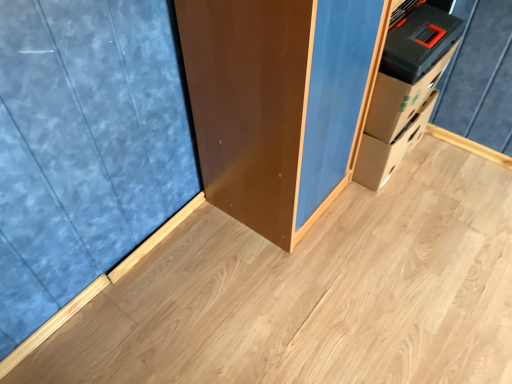
Question: Is natural wood plywood at center at the right side of blue textured curtain at left?

Choices:
 (A) no
 (B) yes

Answer: (B)

Question: Is natural wood plywood at center wider than blue textured curtain at left?

Choices:
 (A) yes
 (B) no

Answer: (A)

Question: From the image's perspective, would you say natural wood plywood at center is positioned over blue textured curtain at left?

Choices:
 (A) yes
 (B) no

Answer: (B)

Question: Is natural wood plywood at center thinner than blue textured curtain at left?

Choices:
 (A) no
 (B) yes

Answer: (A)

Question: Considering the relative positions of natural wood plywood at center and blue textured curtain at left in the image provided, is natural wood plywood at center behind blue textured curtain at left?

Choices:
 (A) no
 (B) yes

Answer: (B)

Question: Is natural wood plywood at center far away from blue textured curtain at left?

Choices:
 (A) no
 (B) yes

Answer: (A)

Question: Can you confirm if blue textured curtain at left is shorter than natural wood plywood at center?

Choices:
 (A) yes
 (B) no

Answer: (B)

Question: Does blue textured curtain at left touch natural wood plywood at center?

Choices:
 (A) no
 (B) yes

Answer: (A)

Question: Is blue textured curtain at left closer to camera compared to natural wood plywood at center?

Choices:
 (A) no
 (B) yes

Answer: (B)

Question: Is blue textured curtain at left to the left of natural wood plywood at center from the viewer's perspective?

Choices:
 (A) yes
 (B) no

Answer: (A)

Question: Is natural wood plywood at center located within blue textured curtain at left?

Choices:
 (A) no
 (B) yes

Answer: (A)

Question: From the image's perspective, would you say blue textured curtain at left is shown under natural wood plywood at center?

Choices:
 (A) yes
 (B) no

Answer: (B)

Question: Is natural wood plywood at center wider or thinner than blue textured curtain at left?

Choices:
 (A) wide
 (B) thin

Answer: (A)